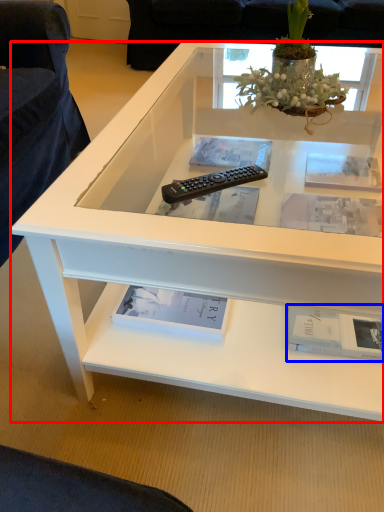
Question: Which point is closer to the camera, desk (highlighted by a red box) or book (highlighted by a blue box)?

Choices:
 (A) desk
 (B) book

Answer: (A)